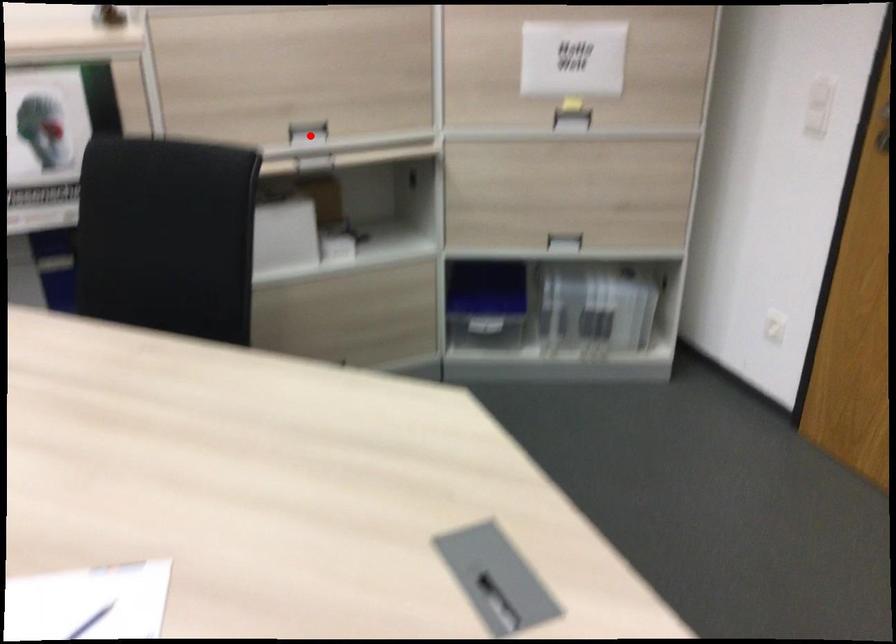
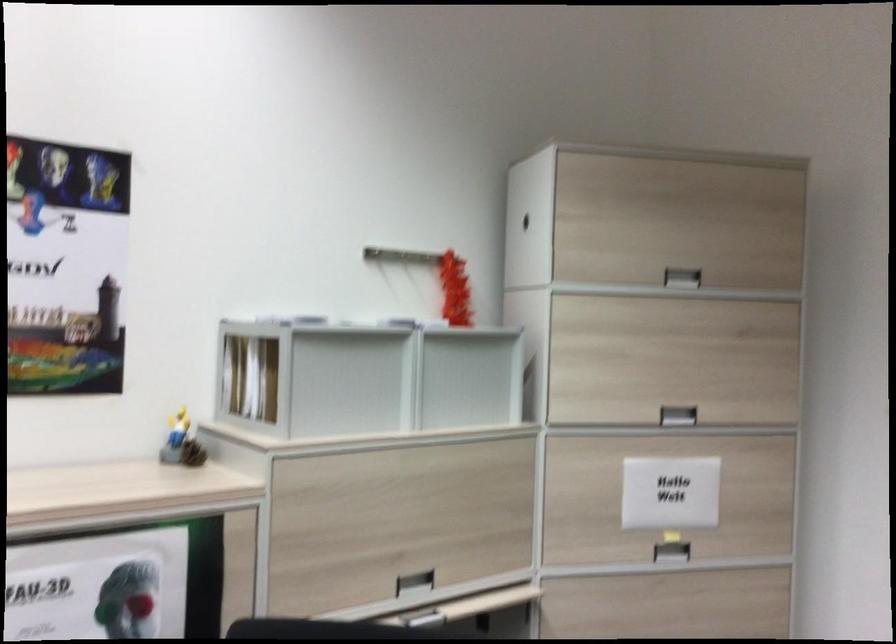
Question: I am providing you with two images of the same scene from different viewpoints. Image1 has a red point marked. In image2, the corresponding 3D location appears at what relative position? Reply with the corresponding letter.

Choices:
 (A) Closer
 (B) Farther

Answer: (A)